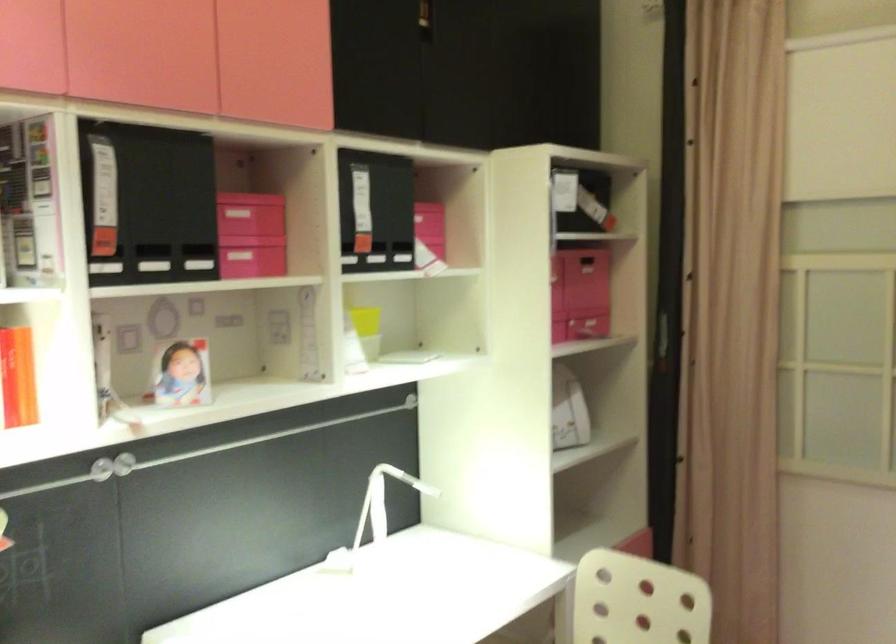
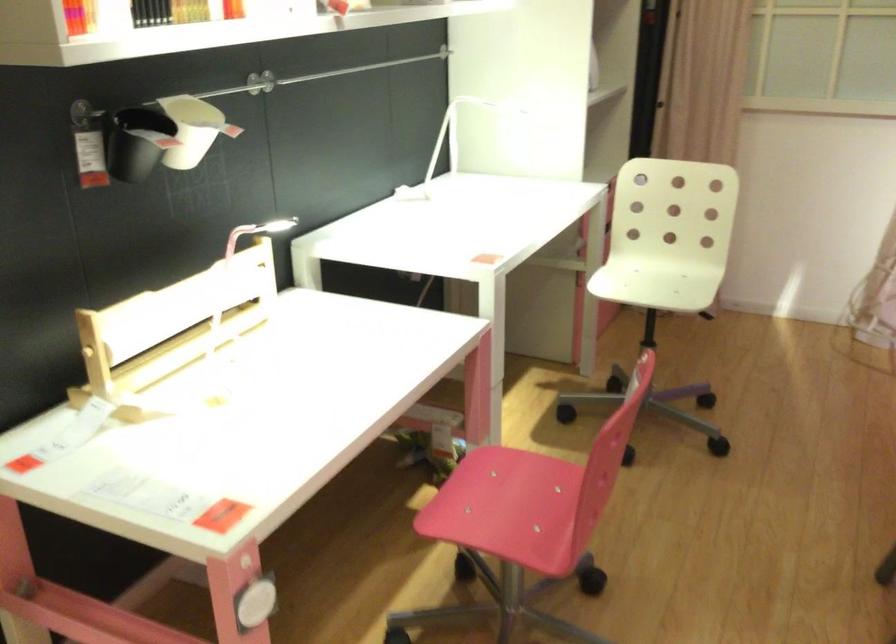
Question: What movement of the cameraman would produce the second image?

Choices:
 (A) Left
 (B) Right
 (C) Forward
 (D) Backward

Answer: (A)